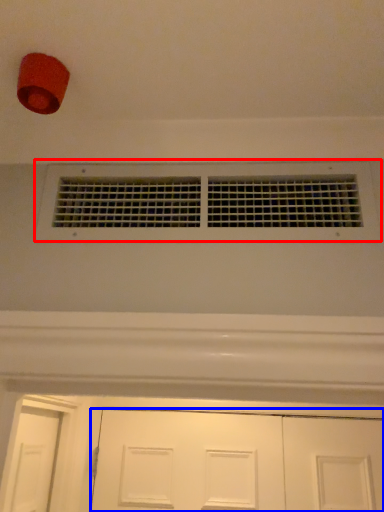
Question: Which object is closer to the camera taking this photo, window (highlighted by a red box) or door (highlighted by a blue box)?

Choices:
 (A) window
 (B) door

Answer: (A)